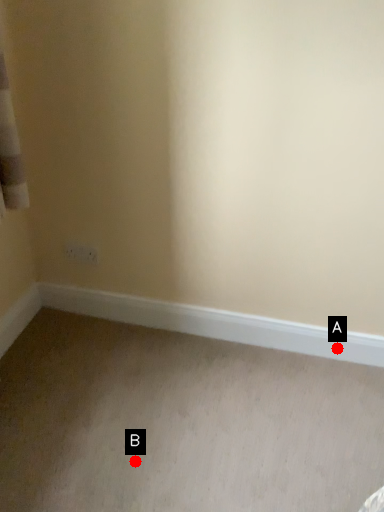
Question: Two points are circled on the image, labeled by A and B beside each circle. Which point appears closest to the camera in this image?

Choices:
 (A) A is closer
 (B) B is closer

Answer: (B)